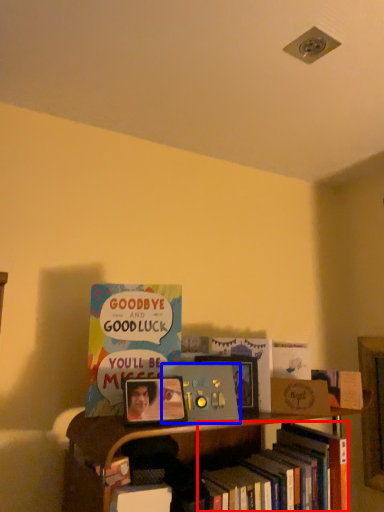
Question: Which object is further to the camera taking this photo, book (highlighted by a red box) or book (highlighted by a blue box)?

Choices:
 (A) book
 (B) book

Answer: (B)